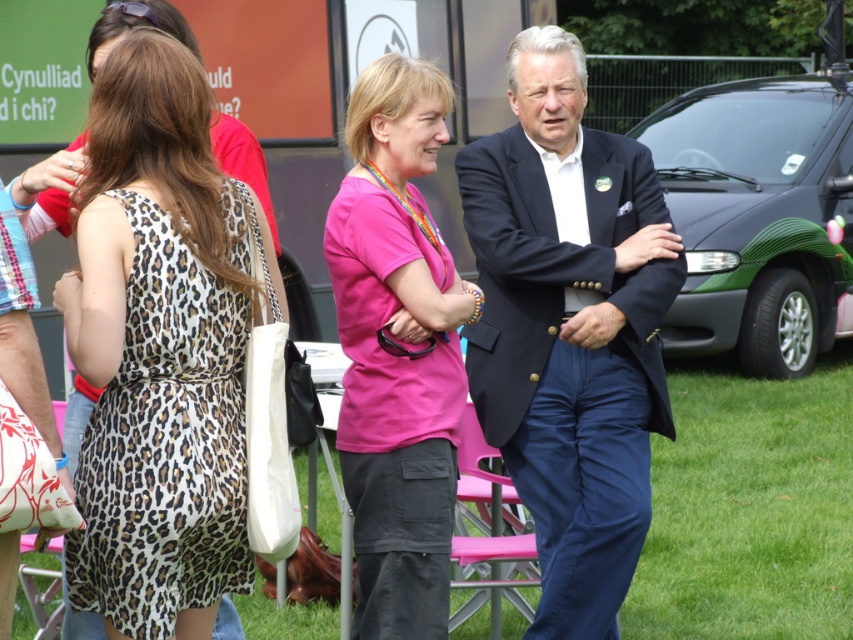
Between point (782, 465) and point (422, 140), which one is positioned in front?

Point (422, 140) is in front.

Find the location of a particular element. The height and width of the screenshot is (640, 853). green grass at center is located at coordinates (749, 508).

Is leopard print dress at left further to camera compared to navy blue suit at center?

No, it is in front of navy blue suit at center.

Who is more forward, (67, 573) or (592, 241)?

Positioned in front is point (67, 573).

The height and width of the screenshot is (640, 853). What are the coordinates of `leopard print dress at left` in the screenshot? It's located at (158, 353).

Locate an element on the screen. This screenshot has height=640, width=853. leopard print dress at left is located at coordinates (158, 353).

Is navy blue suit at center further to the viewer compared to green grass at center?

No, it is in front of green grass at center.

Which of these two, navy blue suit at center or green grass at center, stands shorter?

With less height is green grass at center.

The image size is (853, 640). In order to click on navy blue suit at center in this screenshot , I will do `click(569, 328)`.

The width and height of the screenshot is (853, 640). Find the location of `navy blue suit at center`. navy blue suit at center is located at coordinates (569, 328).